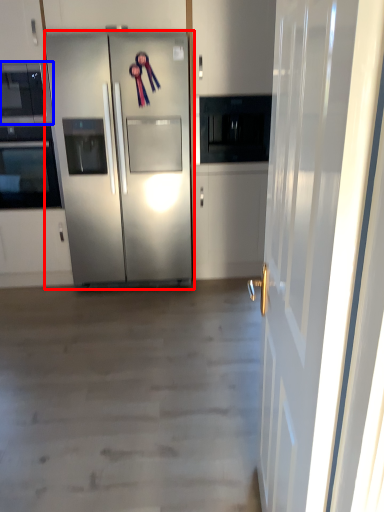
Question: Which point is closer to the camera, refrigerator (highlighted by a red box) or microwave oven (highlighted by a blue box)?

Choices:
 (A) refrigerator
 (B) microwave oven

Answer: (A)